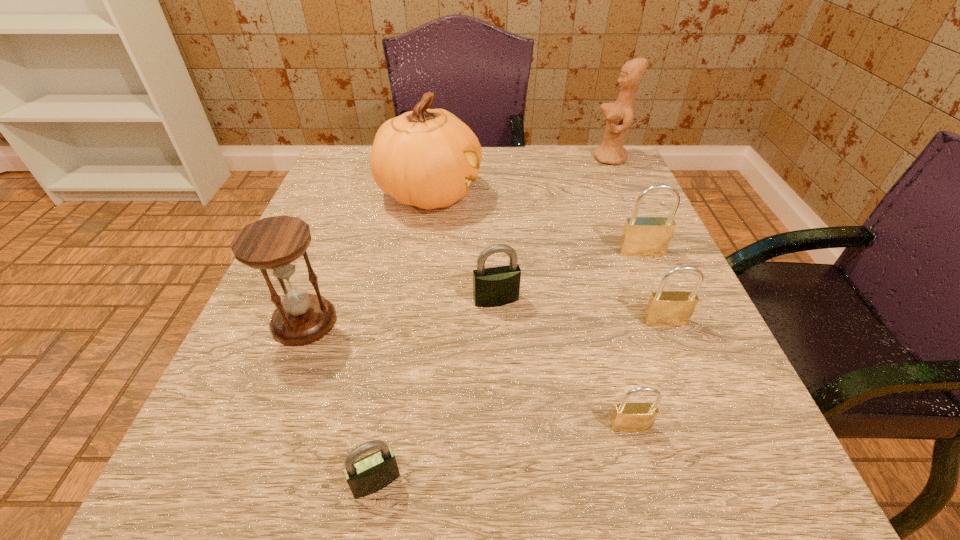
At what (x,y) coordinates should I click in order to perform the action: click on figurine. Please return your answer as a coordinate pair (x, y). The height and width of the screenshot is (540, 960). Looking at the image, I should click on (618, 118).

I want to click on pumpkin, so click(427, 158).

Identify the location of the leftmost object. (272, 244).

I want to click on the tallest padlock, so click(642, 236).

I want to click on the farthest brass padlock, so click(x=642, y=236).

Find the location of a particular element. This screenshot has width=960, height=540. the farther black padlock is located at coordinates (497, 286).

At what (x,y) coordinates should I click in order to perform the action: click on the bigger black padlock. Please return your answer as a coordinate pair (x, y). Looking at the image, I should click on (497, 286).

Identify the location of the second nearest brass padlock. (665, 308).

Identify the location of the second smallest brass padlock. Image resolution: width=960 pixels, height=540 pixels. (665, 308).

Locate an element on the screen. Image resolution: width=960 pixels, height=540 pixels. the smaller black padlock is located at coordinates (374, 472).